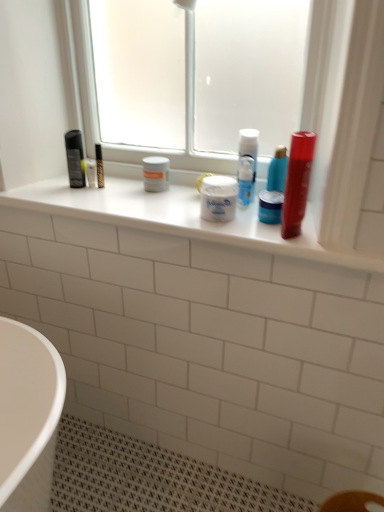
Identify the location of vacant space situated on the left part of shiny red tube at upper right, arranged as the second mouthwash when viewed from the back. (245, 230).